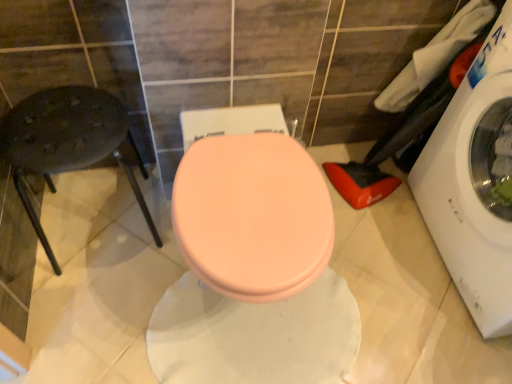
In order to click on vacant area that is situated to the right of matte pink toilet seat at center in this screenshot , I will do `click(391, 283)`.